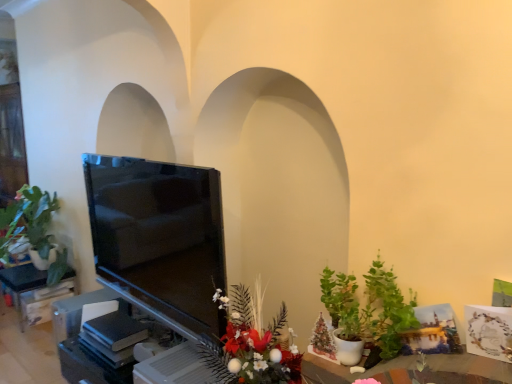
Question: Considering the relative sizes of matte black tv at left and green matte plant at lower right, the 2th houseplant positioned from the back, in the image provided, is matte black tv at left taller than green matte plant at lower right, the 2th houseplant positioned from the back,?

Choices:
 (A) no
 (B) yes

Answer: (B)

Question: Considering the relative sizes of matte black tv at left and green matte plant at lower right, the 2th houseplant positioned from the back, in the image provided, is matte black tv at left smaller than green matte plant at lower right, the 2th houseplant positioned from the back,?

Choices:
 (A) no
 (B) yes

Answer: (A)

Question: Is matte black tv at left shorter than green matte plant at lower right, acting as the 1th houseplant starting from the front?

Choices:
 (A) no
 (B) yes

Answer: (A)

Question: Is green matte plant at lower right, acting as the 1th houseplant starting from the front, surrounded by matte black tv at left?

Choices:
 (A) yes
 (B) no

Answer: (B)

Question: Considering the relative sizes of matte black tv at left and green matte plant at lower right, the 1th houseplant viewed from the right, in the image provided, is matte black tv at left bigger than green matte plant at lower right, the 1th houseplant viewed from the right,?

Choices:
 (A) no
 (B) yes

Answer: (B)

Question: Can you confirm if matte black tv at left is thinner than green matte plant at lower right, the 1th houseplant viewed from the right?

Choices:
 (A) yes
 (B) no

Answer: (A)

Question: Is the surface of green matte plant at lower right, the 2th houseplant viewed from the left, in direct contact with green matte plant at left, arranged as the first houseplant when viewed from the left?

Choices:
 (A) no
 (B) yes

Answer: (A)

Question: Can you confirm if green matte plant at lower right, the 2th houseplant positioned from the back, is bigger than green matte plant at left, the 2th houseplant positioned from the front?

Choices:
 (A) yes
 (B) no

Answer: (B)

Question: Is green matte plant at lower right, the 1th houseplant viewed from the right, behind green matte plant at left, the 2th houseplant positioned from the front?

Choices:
 (A) no
 (B) yes

Answer: (A)

Question: Is green matte plant at lower right, the 2th houseplant positioned from the back, wider than green matte plant at left, arranged as the first houseplant when viewed from the left?

Choices:
 (A) no
 (B) yes

Answer: (A)

Question: Does green matte plant at lower right, the 1th houseplant viewed from the right, have a lesser height compared to green matte plant at left, the first houseplant when ordered from back to front?

Choices:
 (A) no
 (B) yes

Answer: (B)

Question: From a real-world perspective, is green matte plant at lower right, the 2th houseplant viewed from the left, on green matte plant at left, the 2th houseplant positioned from the front?

Choices:
 (A) no
 (B) yes

Answer: (B)

Question: Is matte black tv at left to the left of green matte plant at left, the first houseplant when ordered from back to front, from the viewer's perspective?

Choices:
 (A) no
 (B) yes

Answer: (A)